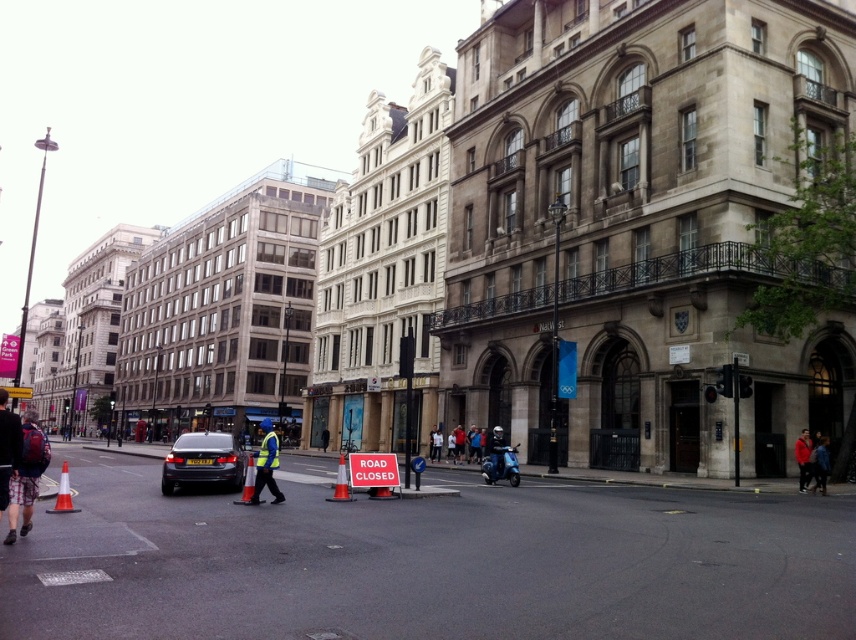
Question: Which object appears closest to the camera in this image?

Choices:
 (A) yellow reflective vest at center
 (B) red jacket at lower right

Answer: (A)

Question: Is orange plastic cone at center in front of orange traffic cone at center?

Choices:
 (A) yes
 (B) no

Answer: (B)

Question: Is dark blue jacket at lower right below orange plastic cone at center?

Choices:
 (A) yes
 (B) no

Answer: (B)

Question: Considering the relative positions of matte black backpack at lower left and orange plastic cone at center in the image provided, where is matte black backpack at lower left located with respect to orange plastic cone at center?

Choices:
 (A) left
 (B) right

Answer: (A)

Question: Which object is closer to the camera taking this photo?

Choices:
 (A) yellow reflective vest at center
 (B) matte black car at center
 (C) red jacket at lower right

Answer: (A)

Question: Which point is closer to the camera?

Choices:
 (A) (801, 483)
 (B) (241, 474)
 (C) (821, 492)

Answer: (B)